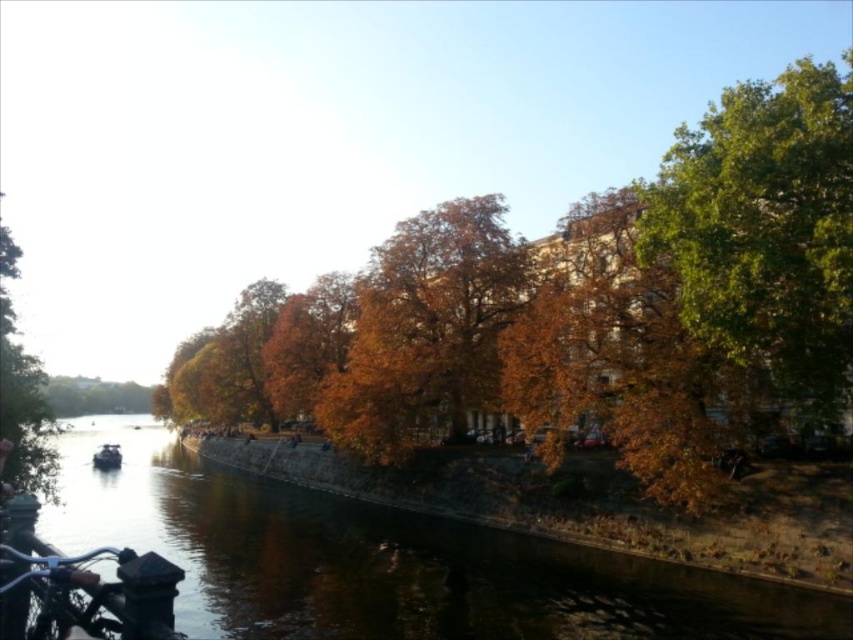
Can you confirm if brown water at center is smaller than green leafy tree at left?

Indeed, brown water at center has a smaller size compared to green leafy tree at left.

Is point (271, 612) farther from viewer compared to point (9, 296)?

No.

Which is in front, point (242, 490) or point (19, 410)?

Point (19, 410) is in front.

Locate an element on the screen. brown water at center is located at coordinates (384, 561).

Between green leafy tree at right and matte black boat at lower left, which one appears on the right side from the viewer's perspective?

From the viewer's perspective, green leafy tree at right appears more on the right side.

Does point (643, 243) come in front of point (99, 454)?

Yes, point (643, 243) is closer to viewer.

Who is more distant from viewer, [785,342] or [102,449]?

The point [102,449] is more distant.

Find the location of a particular element. green leafy tree at right is located at coordinates (764, 230).

Who is more distant from viewer, (547, 451) or (105, 467)?

The point (105, 467) is behind.

Does orange leafy tree at center appear on the right side of matte black boat at lower left?

Yes, orange leafy tree at center is to the right of matte black boat at lower left.

The height and width of the screenshot is (640, 853). What do you see at coordinates (582, 310) in the screenshot?
I see `orange leafy tree at center` at bounding box center [582, 310].

What are the coordinates of `orange leafy tree at center` in the screenshot? It's located at (582, 310).